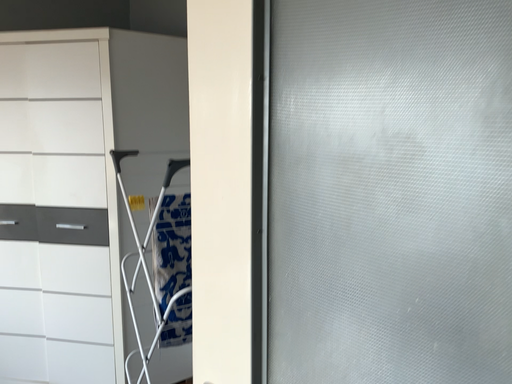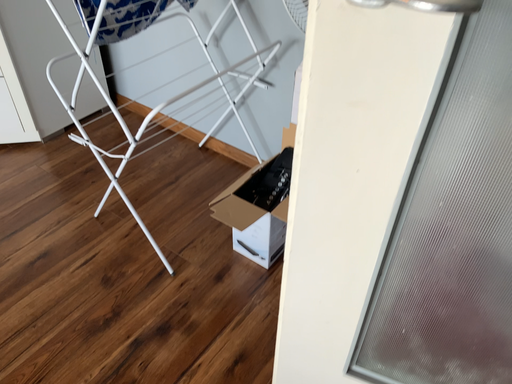
Question: How did the camera likely rotate when shooting the video?

Choices:
 (A) rotated right
 (B) rotated left

Answer: (A)